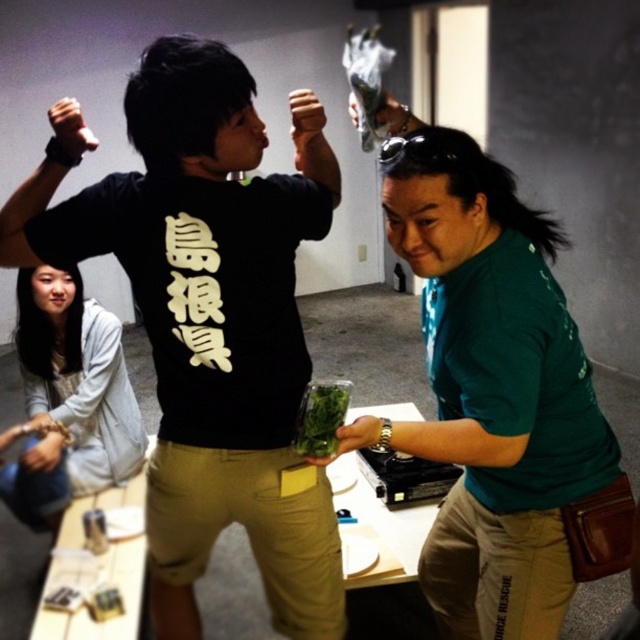
What object is located at the coordinates point (70, 128)?

The black leather wristband at upper left is located at point (70, 128).

You are a delivery person who needs to place a small package on the wooden table at center. The package is 100 centimeters wide. Can you safely place it on the table without it overlapping the green matte leafy greens at center?

The wooden table at center and green matte leafy greens at center are 96.81 centimeters apart. Since the package is 100 centimeters wide, it would overlap the green matte leafy greens at center when placed on the table. Therefore, you cannot safely place the package there without overlapping.

You are at a party and want to place a small gift on the wooden table at center. However, there is a light gray hoodie at lower left in the way. Can you still place the gift on the table without moving the hoodie?

The wooden table at center is behind the light gray hoodie at lower left, so you can still place the gift on the table by going around the hoodie.